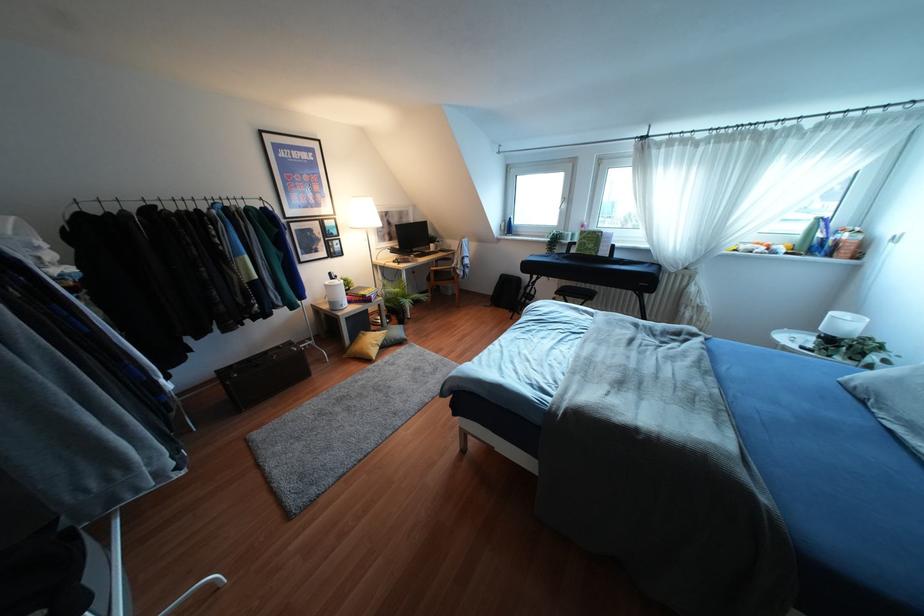
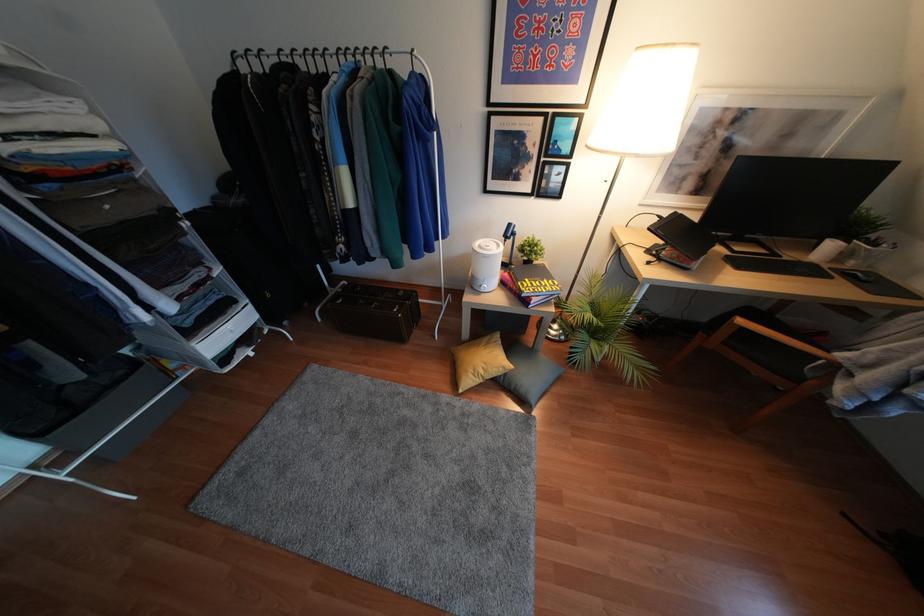
Where in the second image is the point corresponding to pixel 370 366 from the first image?

(445, 397)